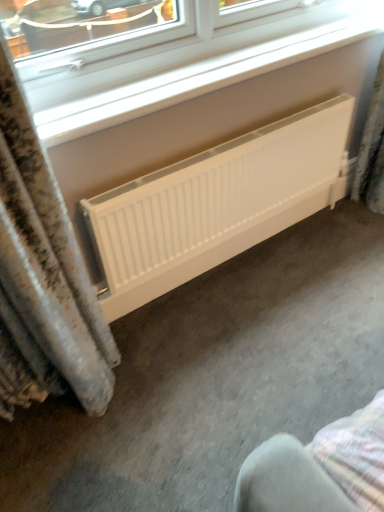
Identify the location of vacant space underneath white matte radiator at center (from a real-world perspective). The width and height of the screenshot is (384, 512). (239, 260).